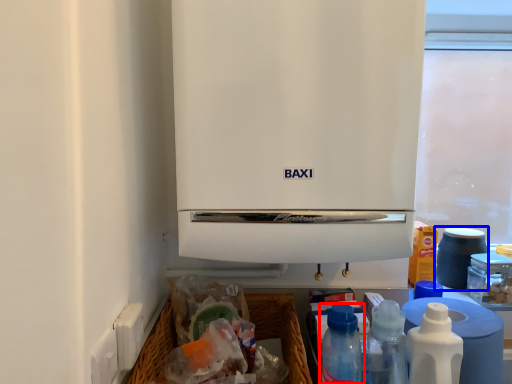
Question: Which object appears farthest to the camera in this image, bottle (highlighted by a red box) or appliance (highlighted by a blue box)?

Choices:
 (A) bottle
 (B) appliance

Answer: (B)